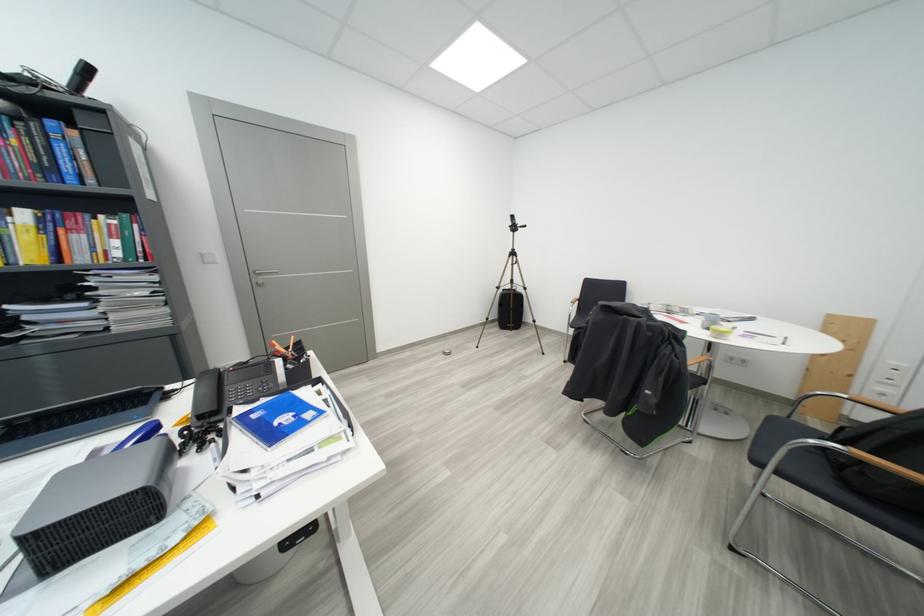
This screenshot has height=616, width=924. What do you see at coordinates (261, 275) in the screenshot?
I see `the silver door handle` at bounding box center [261, 275].